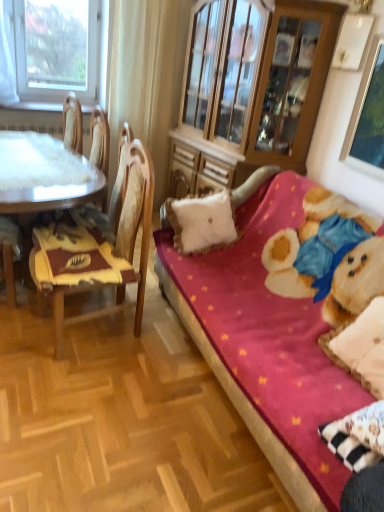
Question: Is white fabric curtain at upper left further to the viewer compared to white glossy table at left?

Choices:
 (A) yes
 (B) no

Answer: (A)

Question: From the image's perspective, would you say white fabric curtain at upper left is positioned over white glossy table at left?

Choices:
 (A) no
 (B) yes

Answer: (B)

Question: Considering the relative sizes of white fabric curtain at upper left and white glossy table at left in the image provided, is white fabric curtain at upper left shorter than white glossy table at left?

Choices:
 (A) no
 (B) yes

Answer: (A)

Question: Is white fabric curtain at upper left not within white glossy table at left?

Choices:
 (A) yes
 (B) no

Answer: (A)

Question: Can you confirm if white fabric curtain at upper left is positioned to the left of white glossy table at left?

Choices:
 (A) yes
 (B) no

Answer: (B)

Question: Is transparent glass window at upper left situated inside white glossy table at left or outside?

Choices:
 (A) outside
 (B) inside

Answer: (A)

Question: Considering the relative positions of transparent glass window at upper left and white glossy table at left in the image provided, is transparent glass window at upper left to the left or to the right of white glossy table at left?

Choices:
 (A) right
 (B) left

Answer: (B)

Question: In the image, is transparent glass window at upper left positioned in front of or behind white glossy table at left?

Choices:
 (A) front
 (B) behind

Answer: (B)

Question: From the image's perspective, is transparent glass window at upper left located above or below white glossy table at left?

Choices:
 (A) below
 (B) above

Answer: (B)

Question: From a real-world perspective, is wooden chair at left physically located above or below white fabric curtain at upper left?

Choices:
 (A) above
 (B) below

Answer: (B)

Question: From the image's perspective, is wooden chair at left positioned above or below white fabric curtain at upper left?

Choices:
 (A) below
 (B) above

Answer: (A)

Question: In the image, is wooden chair at left positioned in front of or behind white fabric curtain at upper left?

Choices:
 (A) front
 (B) behind

Answer: (A)

Question: Would you say wooden chair at left is to the left or to the right of white fabric curtain at upper left in the picture?

Choices:
 (A) left
 (B) right

Answer: (A)

Question: From their relative heights in the image, would you say white fabric curtain at upper left is taller or shorter than white soft cushion at center?

Choices:
 (A) short
 (B) tall

Answer: (B)

Question: Relative to white soft cushion at center, is white fabric curtain at upper left in front or behind?

Choices:
 (A) behind
 (B) front

Answer: (A)